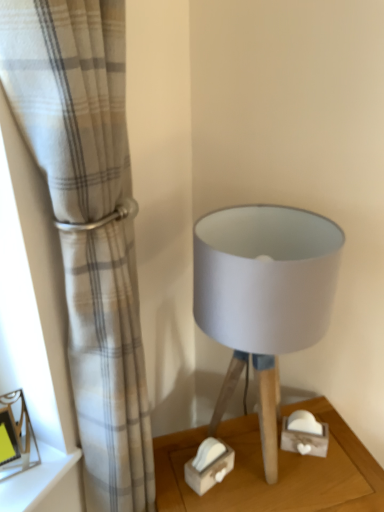
The image size is (384, 512). In order to click on free space above matte white frame at lower left (from a real-world perspective) in this screenshot , I will do `click(17, 462)`.